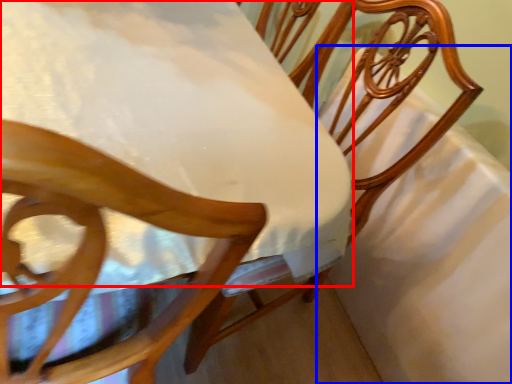
Question: Which object is closer to the camera taking this photo, table (highlighted by a red box) or sheet (highlighted by a blue box)?

Choices:
 (A) table
 (B) sheet

Answer: (A)